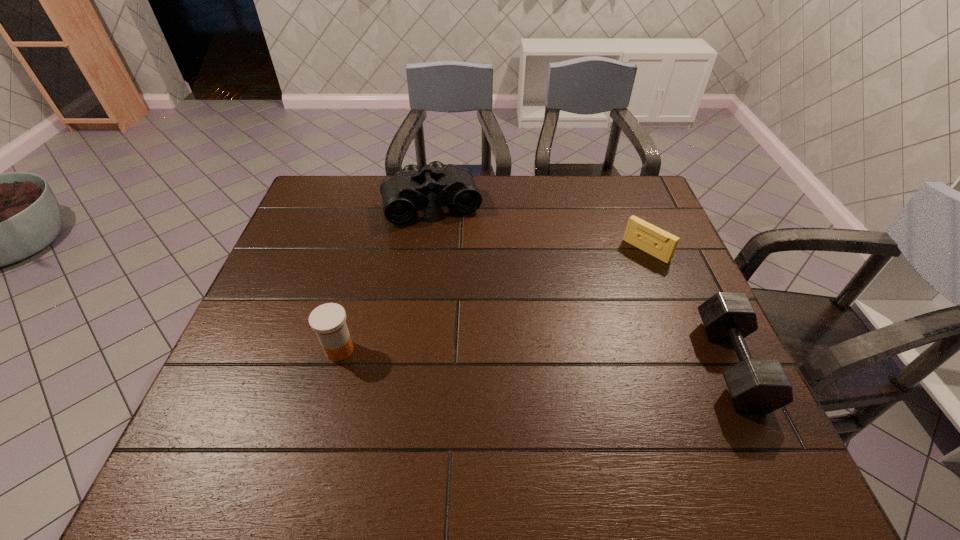
At what (x,y) coordinates should I click in order to perform the action: click on free space between the dumbbell and the medicine. Please return your answer as a coordinate pair (x, y). Image resolution: width=960 pixels, height=540 pixels. Looking at the image, I should click on (536, 357).

This screenshot has width=960, height=540. What are the coordinates of `vacant region between the medicine and the second farthest object` in the screenshot? It's located at (492, 300).

Locate an element on the screen. free area in between the videotape and the medicine is located at coordinates (492, 300).

This screenshot has height=540, width=960. I want to click on vacant space that's between the medicine and the farthest object, so click(x=386, y=276).

The width and height of the screenshot is (960, 540). Find the location of `empty space that is in between the second farthest object and the dumbbell`. empty space that is in between the second farthest object and the dumbbell is located at coordinates (688, 307).

Locate which object ranks in proximity to the medicine. Please provide its 2D coordinates. Your answer should be formatted as a tuple, i.e. [(x, y)], where the tuple contains the x and y coordinates of a point satisfying the conditions above.

[(405, 192)]

Find the location of a particular element. object that is the closest to the medicine is located at coordinates (405, 192).

At what (x,y) coordinates should I click in order to perform the action: click on free location that satisfies the following two spatial constraints: 1. on the front side of the farthest object; 2. on the left side of the shortest object. Please return your answer as a coordinate pair (x, y). This screenshot has width=960, height=540. Looking at the image, I should click on (426, 250).

The width and height of the screenshot is (960, 540). Identify the location of vacant space that satisfies the following two spatial constraints: 1. on the label of the dumbbell; 2. on the right side of the medicine. (335, 364).

You are a GUI agent. You are given a task and a screenshot of the screen. Output one action in this format:
    pyautogui.click(x=<x>, y=<y>)
    Task: Click on the free space that satisfies the following two spatial constraints: 1. on the label of the medicine; 2. on the left side of the dumbbell
    The height and width of the screenshot is (540, 960).
    Given the screenshot: What is the action you would take?
    pyautogui.click(x=335, y=364)